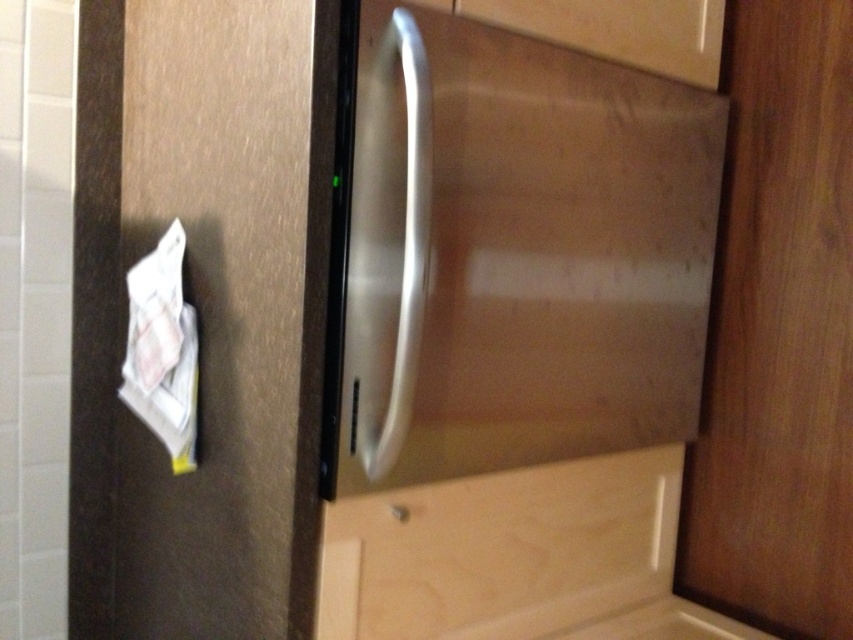
You are trying to clean the kitchen and need to reach into the light wood drawer at lower center and the satin silver handle at center. Which one requires you to bend down more?

The light wood drawer at lower center is bigger than the satin silver handle at center, so you would need to bend down more to reach the light wood drawer at lower center.

You are trying to open the light wood drawer at lower center but it is stuck. You notice the satin silver handle at center nearby. Which object is closer to you to reach first?

The light wood drawer at lower center is closer to you than the satin silver handle at center, so you can reach it first.